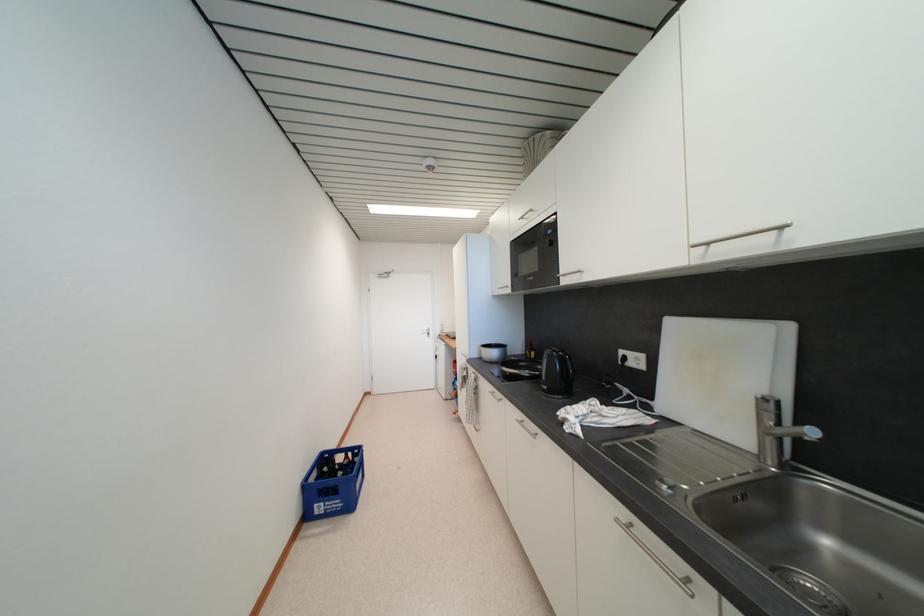
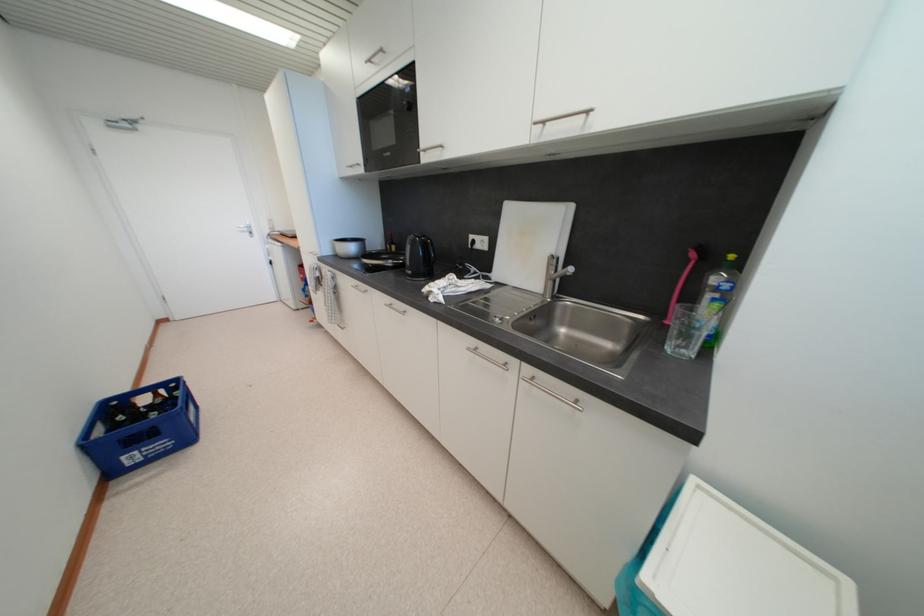
In the second image, find the point that corresponds to (324,509) in the first image.

(138, 460)